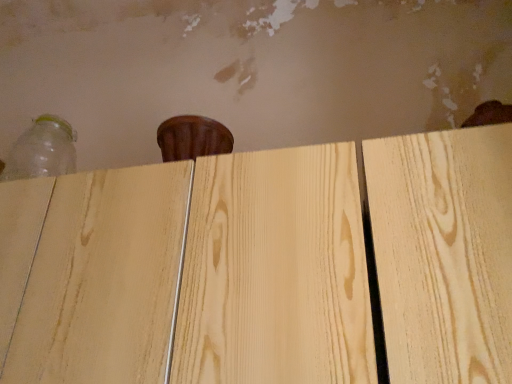
Question: From a real-world perspective, is natural wood plywood at center below transparent plastic bottle at upper left?

Choices:
 (A) no
 (B) yes

Answer: (B)

Question: Is natural wood plywood at center thinner than transparent plastic bottle at upper left?

Choices:
 (A) no
 (B) yes

Answer: (A)

Question: Is there a large distance between natural wood plywood at center and transparent plastic bottle at upper left?

Choices:
 (A) no
 (B) yes

Answer: (A)

Question: Is natural wood plywood at center wider than transparent plastic bottle at upper left?

Choices:
 (A) no
 (B) yes

Answer: (B)

Question: Is natural wood plywood at center surrounding transparent plastic bottle at upper left?

Choices:
 (A) no
 (B) yes

Answer: (A)

Question: Does natural wood plywood at center have a lesser height compared to transparent plastic bottle at upper left?

Choices:
 (A) no
 (B) yes

Answer: (A)

Question: Is transparent plastic bottle at upper left outside of natural wood plywood at center?

Choices:
 (A) no
 (B) yes

Answer: (B)

Question: Can you confirm if transparent plastic bottle at upper left is thinner than natural wood plywood at center?

Choices:
 (A) no
 (B) yes

Answer: (B)

Question: Does transparent plastic bottle at upper left have a lesser height compared to natural wood plywood at center?

Choices:
 (A) yes
 (B) no

Answer: (A)

Question: Is transparent plastic bottle at upper left to the left of natural wood plywood at center from the viewer's perspective?

Choices:
 (A) no
 (B) yes

Answer: (B)

Question: Does transparent plastic bottle at upper left have a greater width compared to natural wood plywood at center?

Choices:
 (A) no
 (B) yes

Answer: (A)

Question: From a real-world perspective, is transparent plastic bottle at upper left located beneath natural wood plywood at center?

Choices:
 (A) yes
 (B) no

Answer: (B)

Question: Is natural wood plywood at center taller or shorter than transparent plastic bottle at upper left?

Choices:
 (A) short
 (B) tall

Answer: (B)